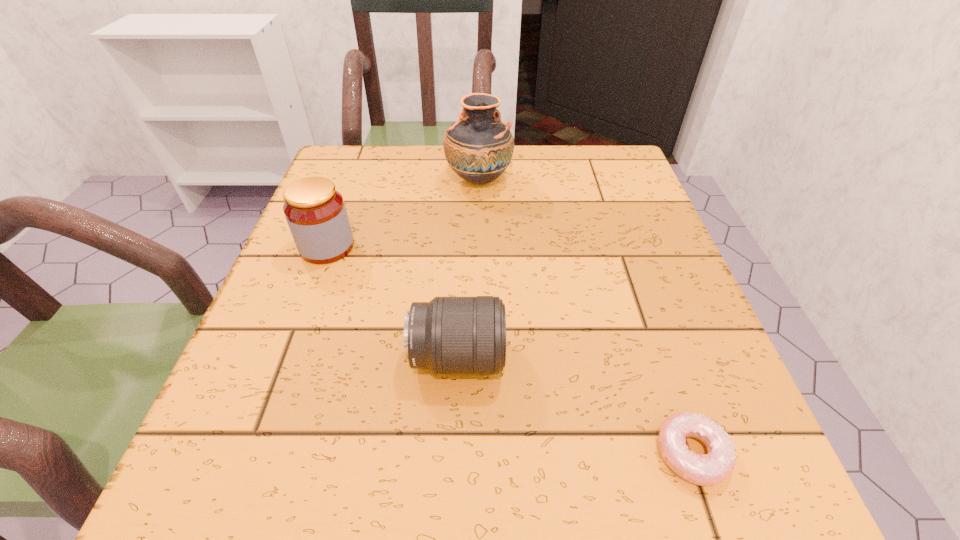
You are a GUI agent. You are given a task and a screenshot of the screen. Output one action in this format:
    pyautogui.click(x=<x>, y=<y>)
    Task: Click on the free point located 0.230m on the surface of the second shortest object
    The height and width of the screenshot is (540, 960).
    Given the screenshot: What is the action you would take?
    pyautogui.click(x=652, y=357)

At what (x,y) coordinates should I click in order to perform the action: click on free space located on the right of the doughnut. Please return your answer as a coordinate pair (x, y). The image size is (960, 540). Looking at the image, I should click on (765, 454).

Where is `object present at the far edge`? object present at the far edge is located at coordinates (479, 147).

Find the location of `object that is positioned at the near edge`. object that is positioned at the near edge is located at coordinates (x=705, y=470).

Find the location of a particular element. The height and width of the screenshot is (540, 960). object at the left edge is located at coordinates 315,211.

The image size is (960, 540). Identify the location of object that is positioned at the right edge. (705, 470).

I want to click on object that is at the near right corner, so click(x=705, y=470).

At what (x,y) coordinates should I click in order to perform the action: click on free location at the near edge of the desktop. Please return your answer as a coordinate pair (x, y). Looking at the image, I should click on pos(491,498).

In the image, there is a desktop. Where is `vacant space at the left edge`? This screenshot has width=960, height=540. vacant space at the left edge is located at coordinates (277, 407).

In the image, there is a desktop. Where is `vacant area at the right edge`? The image size is (960, 540). vacant area at the right edge is located at coordinates (607, 329).